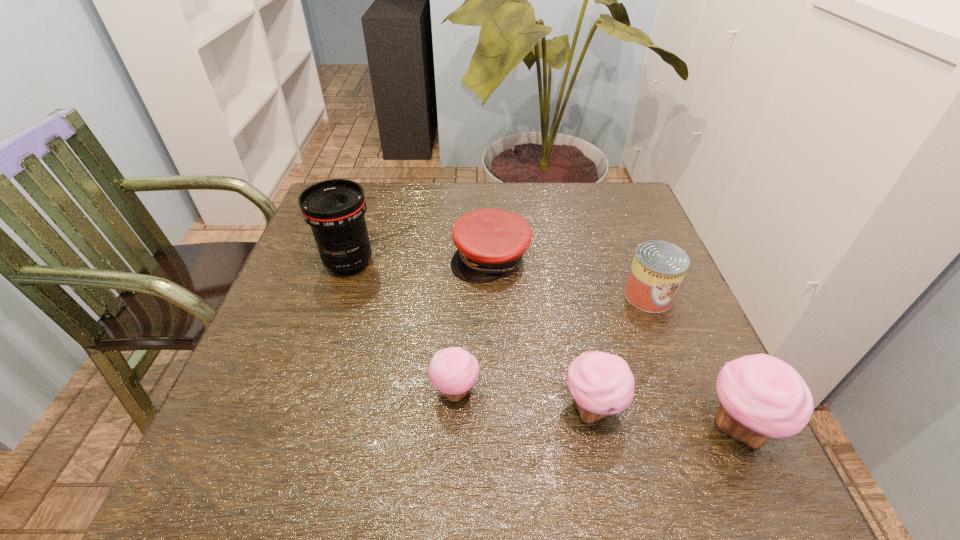
I want to click on the shortest cupcake, so (x=453, y=371).

Where is `the second cupcake from right to left`? Image resolution: width=960 pixels, height=540 pixels. the second cupcake from right to left is located at coordinates (602, 384).

Where is `the second tallest cupcake`? The image size is (960, 540). the second tallest cupcake is located at coordinates (602, 384).

The image size is (960, 540). In order to click on the fifth shortest object in this screenshot , I will do `click(762, 397)`.

You are a GUI agent. You are given a task and a screenshot of the screen. Output one action in this format:
    pyautogui.click(x=<x>, y=<y>)
    Task: Click on the tallest cupcake
    The image size is (960, 540).
    Given the screenshot: What is the action you would take?
    pyautogui.click(x=762, y=397)

Find the location of a particular element. The height and width of the screenshot is (540, 960). cap is located at coordinates (490, 242).

Find the location of a particular element. The height and width of the screenshot is (540, 960). can is located at coordinates (658, 268).

This screenshot has height=540, width=960. Identify the location of the tallest object. (335, 208).

Find the location of a particular element. This screenshot has width=960, height=540. telephoto lens is located at coordinates (335, 208).

Locate an element on the screen. Image resolution: width=960 pixels, height=540 pixels. free space located 0.390m on the back of the shortest cupcake is located at coordinates (462, 244).